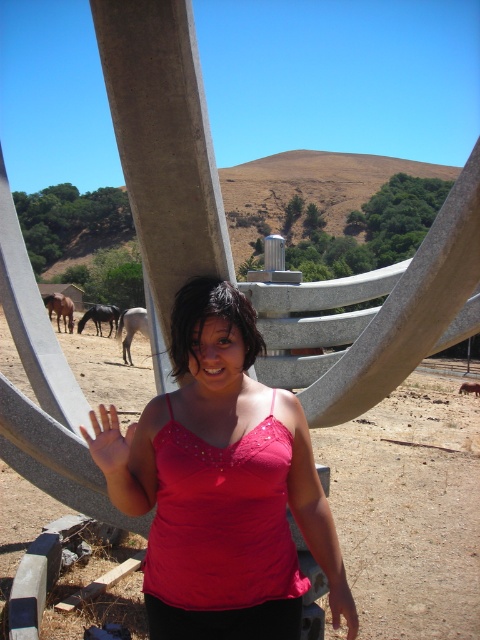
You are a photographer trying to capture the pink fabric hand at center and the dark brown horse at center in the same frame. Which object should you focus on first to ensure both are in focus?

The pink fabric hand at center is in front of the dark brown horse at center, so you should focus on the pink fabric hand at center first to ensure both are in focus.